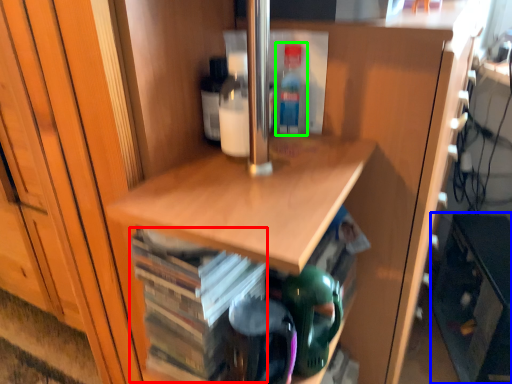
Question: Based on their relative distances, which object is nearer to book (highlighted by a red box)? Choose from cabinetry (highlighted by a blue box) and bottle (highlighted by a green box).

Choices:
 (A) cabinetry
 (B) bottle

Answer: (B)